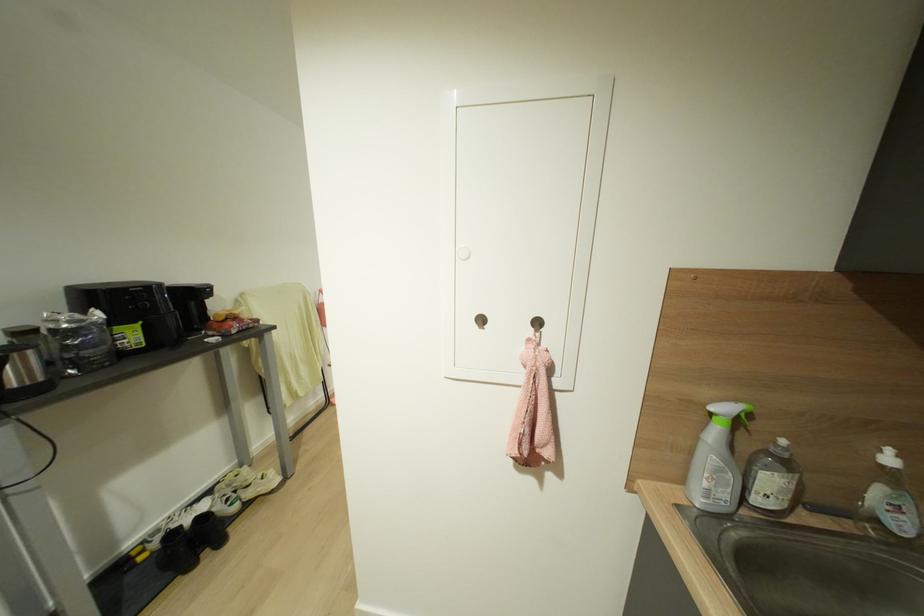
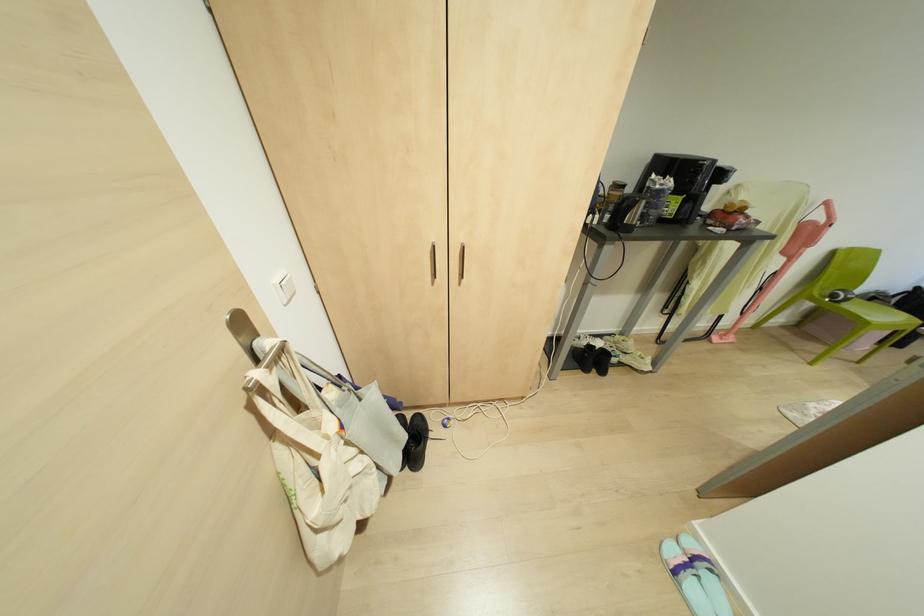
In the second image, find the point that corresponds to [320,291] in the first image.

(825, 203)